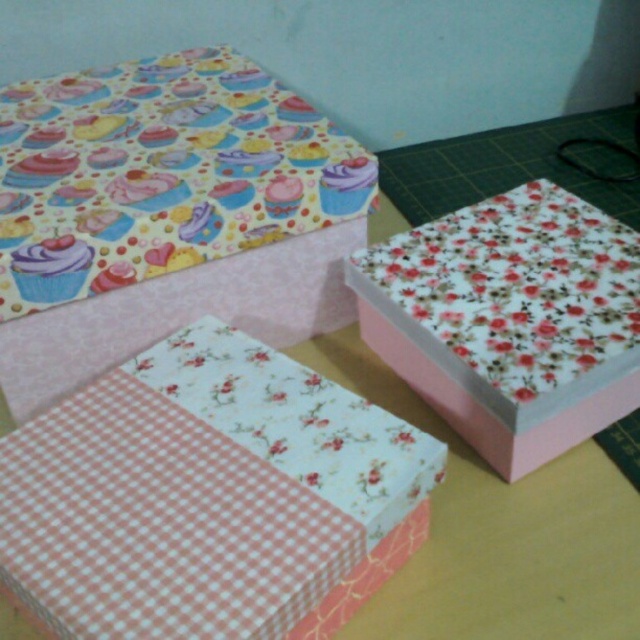
Consider the image. You are standing 30 inches away from the table where the boxes are placed. If you move forward by 10 inches, will the point at the bottom left box labeled as point (256, 584) be closer to you than before?

The point at the bottom left box labeled as point (256, 584) is currently 30.21 inches away from you. If you move forward by 10 inches, your new distance to the point would be 20.21 inches, which is closer than before.

You are standing at the origin point of the coordinate system. Which object is closer to you, the pink checkered paper at lower left or the top left box?

The pink checkered paper at lower left is closer to you because its position at point (209,497) is closer to the origin compared to the top left box.